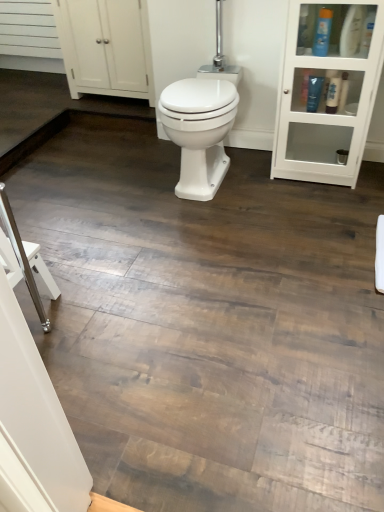
The width and height of the screenshot is (384, 512). Identify the location of free space in front of white glossy bidet at center. (212, 227).